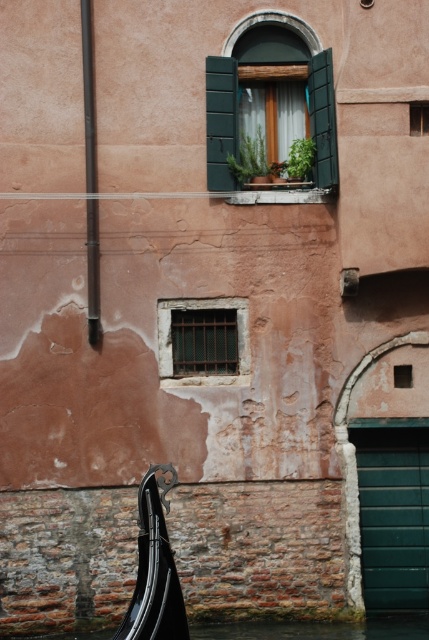
You are an architect assessing the building facade. You need to install a new security camera that must be placed at the midpoint between the smooth dark brown pole at left and the matte green window at center. Based on their heights, which object will the camera be closer to?

The smooth dark brown pole at left has a greater height compared to matte green window at center. Since the camera is placed at the midpoint between them, it will be closer to the shorter object, which is the matte green window at center.

You are standing 15 meters away from a historic building with a window adorned with potted plants. If you move forward 0.64 meters towards the building, will you be closer than 14 meters to the point marked as point (208,156)?

Yes, moving forward 0.64 meters from 15 meters brings you to 14.36 meters away from the point. Since 14.36 meters is less than 14 meters, you will be closer than 14 meters to point (208,156).

You are standing in front of the weathered building and want to touch both points on the wall. Which point should you reach for first, point [232,369] or point [414,109]?

You should reach for point [232,369] first because it is closer to you than point [414,109], which is further away.